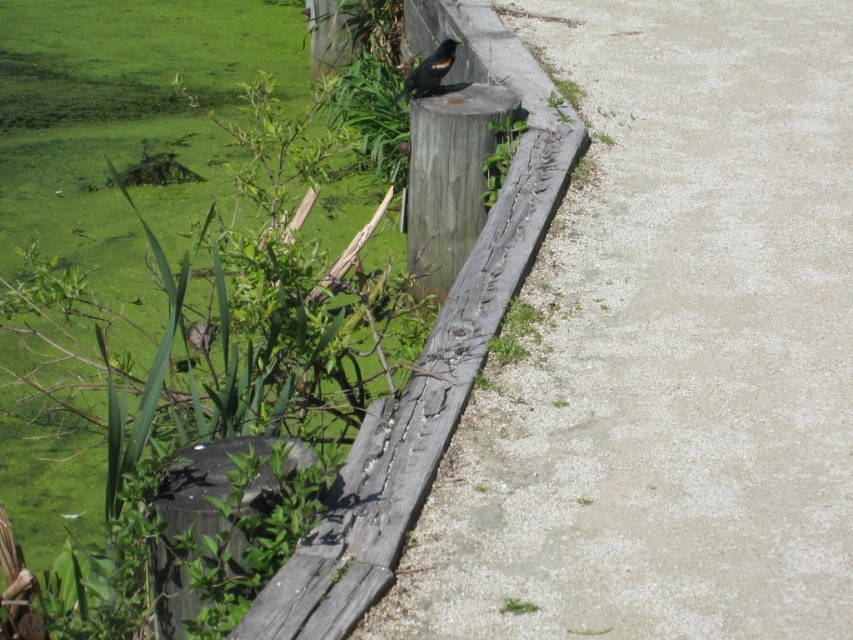
You are standing at the wooden railing along the path and want to walk to the gray concrete sidewalk at center. According to the coordinates provided, in which direction should you move relative to the wooden railing?

The gray concrete sidewalk at center is located at point (666, 349), so you should move towards the center of the image from the wooden railing to reach it.

You are standing at the edge of the wooden railing and want to take a photo of both point (659, 372) and point (334, 488). Which point should you focus on first to ensure both are in clear view?

You should focus on point (659, 372) first because it is closer to the camera than point (334, 488). This ensures both points will be in focus when using a camera with a fixed focal plane.